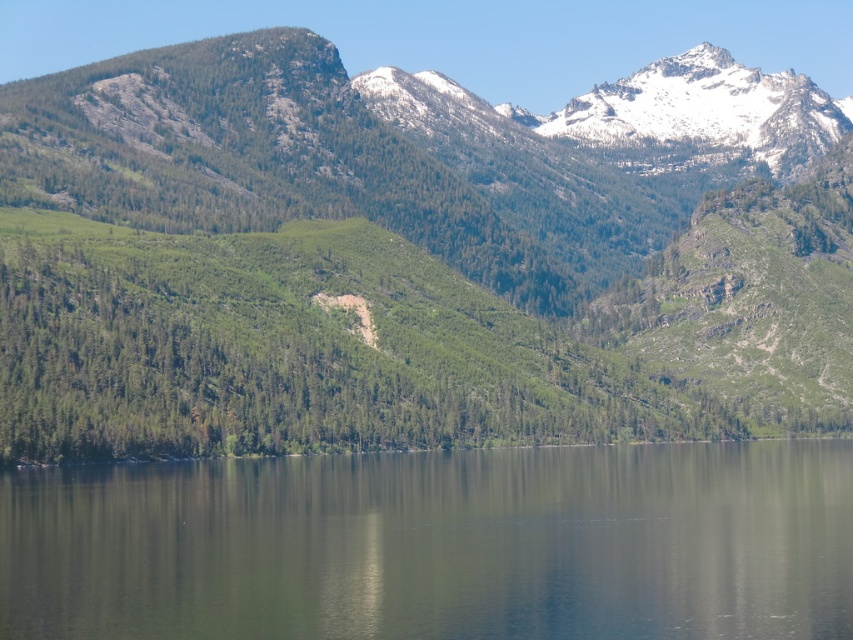
Is point (622, 109) closer to viewer compared to point (239, 625)?

That is False.

Between point (312, 301) and point (676, 586), which one is positioned behind?

Point (312, 301)

Locate an element on the screen. Image resolution: width=853 pixels, height=640 pixels. green forested mountain at center is located at coordinates (415, 257).